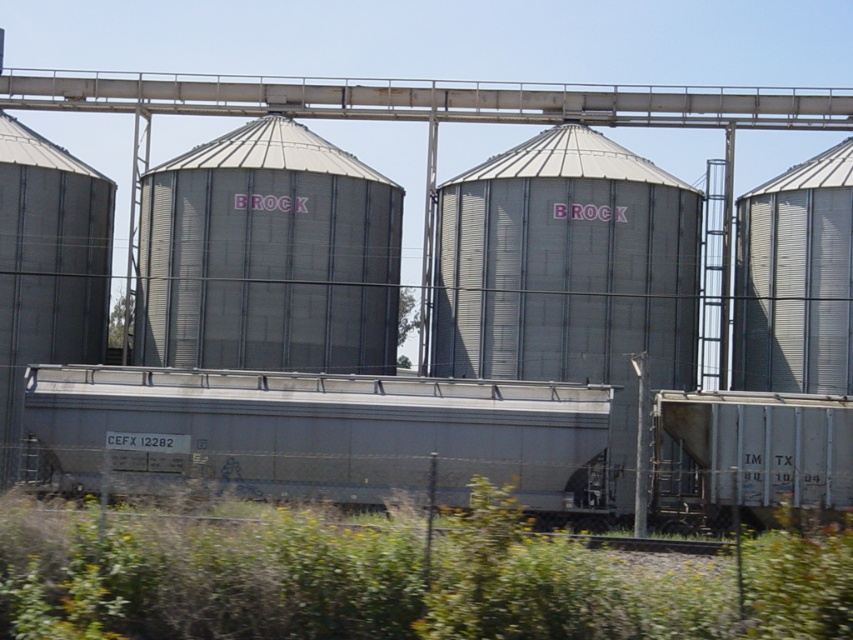
Question: Does silver metallic train car at center have a larger size compared to metallic silver silo at right?

Choices:
 (A) yes
 (B) no

Answer: (A)

Question: Which of these objects is positioned closest to the metallic silver silo at right?

Choices:
 (A) metallic gray silo at center
 (B) silver metallic train car at center

Answer: (A)

Question: Which point appears closest to the camera in this image?

Choices:
 (A) (846, 205)
 (B) (345, 369)

Answer: (A)

Question: Does metallic gray silo at center lie behind metallic silver silo at right?

Choices:
 (A) yes
 (B) no

Answer: (A)

Question: In this image, where is metallic gray silo at center located relative to metallic silver silo at right?

Choices:
 (A) above
 (B) below

Answer: (A)

Question: Among these objects, which one is farthest from the camera?

Choices:
 (A) metallic gray silo at center
 (B) silver metallic train car at center
 (C) metallic silver silo at right

Answer: (A)